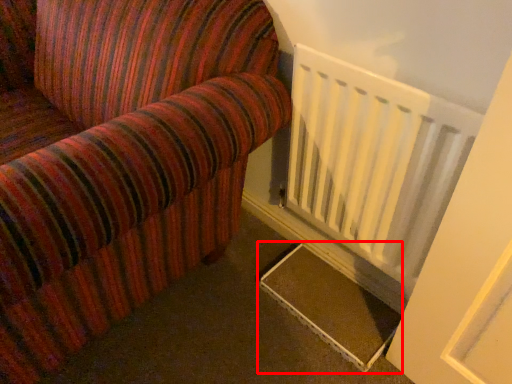
Question: Considering the relative positions of stairs (annotated by the red box) and radiator in the image provided, where is stairs (annotated by the red box) located with respect to the staircase?

Choices:
 (A) right
 (B) left

Answer: (B)